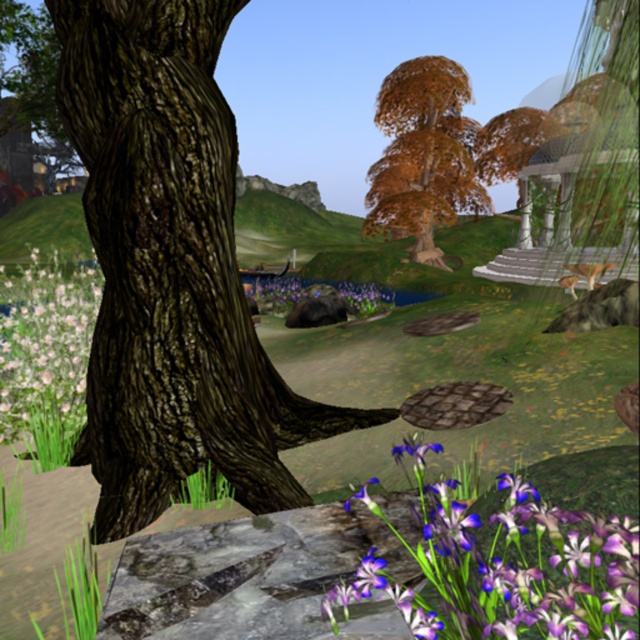
Question: Is rough bark tree at left below orange-brown textured tree at upper center?

Choices:
 (A) no
 (B) yes

Answer: (B)

Question: Which of these objects is positioned farthest from the orange-brown textured tree at upper center?

Choices:
 (A) purple matte flowers at center
 (B) rough bark tree at left
 (C) white fluffy flower at lower left

Answer: (B)

Question: Which point is farther to the camera?

Choices:
 (A) (76, 298)
 (B) (586, 541)
 (C) (275, 312)
 (D) (397, 182)

Answer: (D)

Question: Which point is farther to the camera?

Choices:
 (A) (44, 307)
 (B) (202, 250)

Answer: (A)

Question: Can you confirm if white fluffy flower at lower left is positioned to the right of purple matte flowers at center?

Choices:
 (A) no
 (B) yes

Answer: (A)

Question: Is rough bark tree at left closer to the viewer compared to purple matte flowers at center?

Choices:
 (A) no
 (B) yes

Answer: (B)